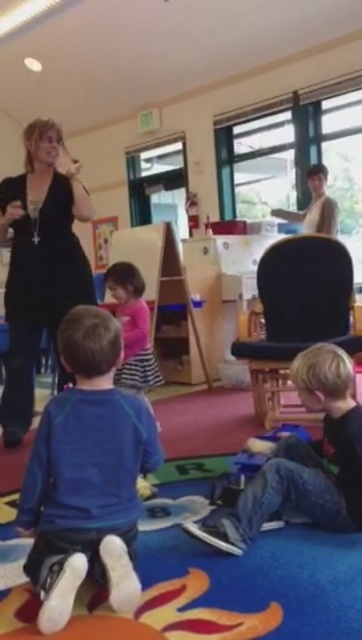
You are a parent trying to choose an outfit for your child from the options available in the image. The black matte dress at left and the jeans at lower right are both on the floor. Considering their sizes, which one would you pick if you want something bigger?

The black matte dress at left is larger in size compared to the jeans at lower right, so you should choose the black matte dress at left if you want something bigger.

You are standing in the classroom and want to find the black matte dress at left. Which direction should you look to locate the point at coordinates (39, 260)?

The point at coordinates (39, 260) is on the black matte dress at left, so you should look towards the left side of the image to locate it.